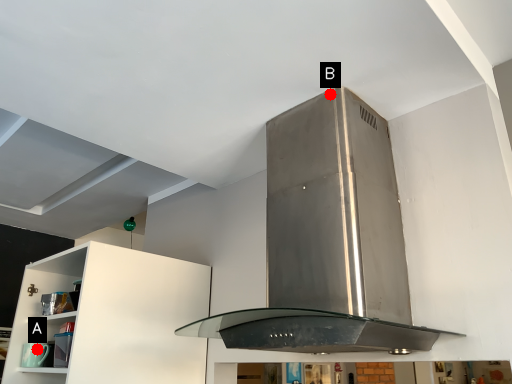
Question: Two points are circled on the image, labeled by A and B beside each circle. Which of the following is the closest to the observer?

Choices:
 (A) A is closer
 (B) B is closer

Answer: (B)